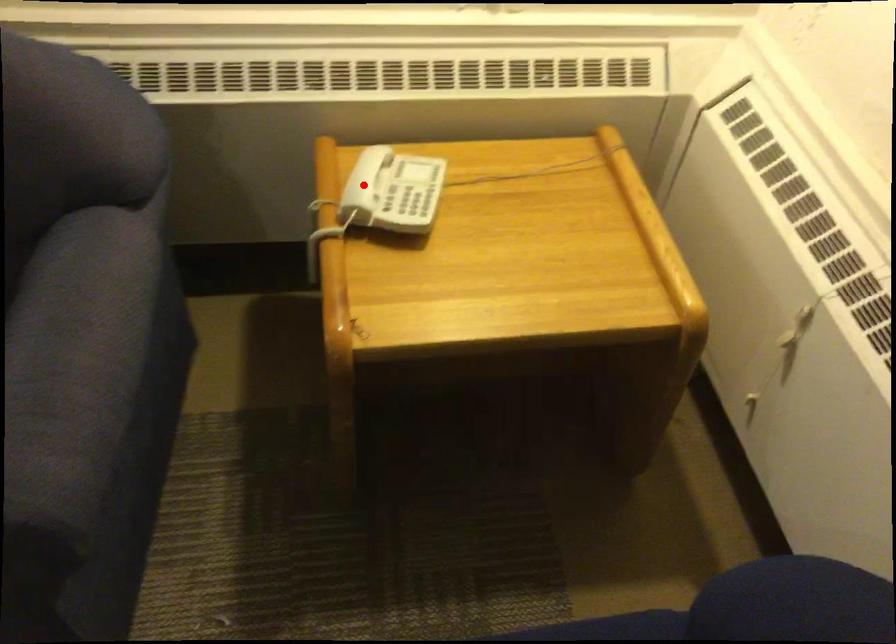
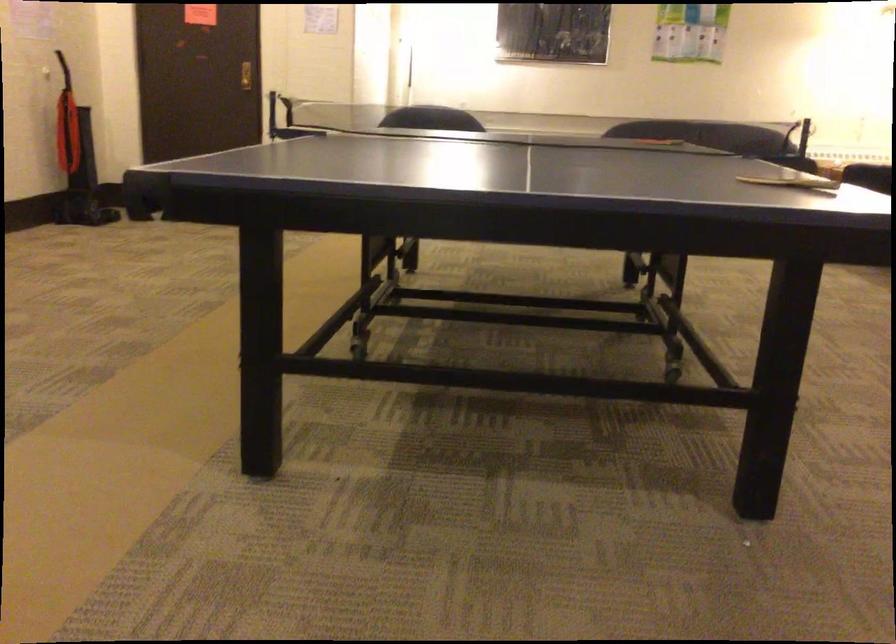
Question: I am providing you with two images of the same scene from different viewpoints. A red point is marked on the first image. Can you still see the location of the red point in image 2?

Choices:
 (A) Yes
 (B) No

Answer: (B)